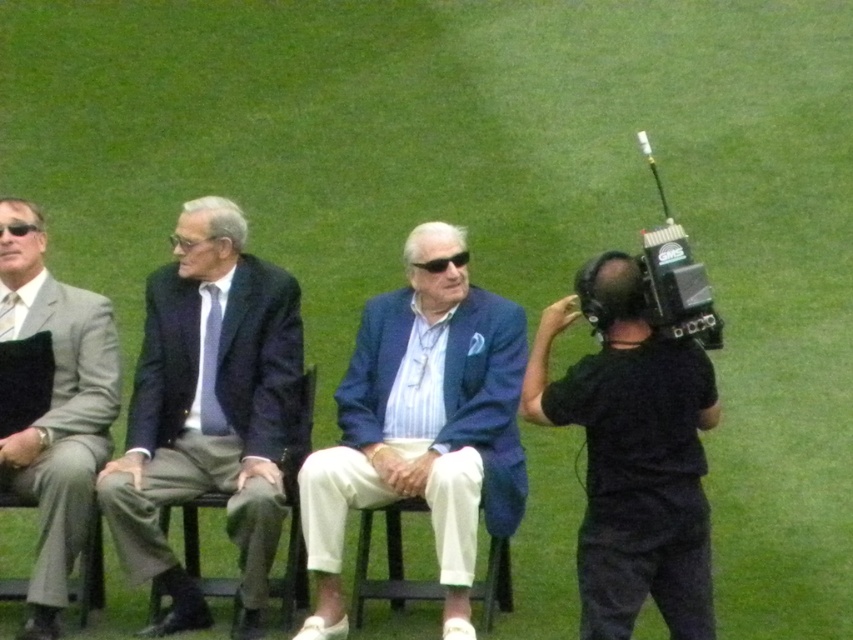
Question: Which point is closer to the camera?

Choices:
 (A) (39, 520)
 (B) (337, 502)
 (C) (692, 316)

Answer: (C)

Question: Considering the relative positions of black matte camera at right and dark gray fabric chair at center in the image provided, where is black matte camera at right located with respect to dark gray fabric chair at center?

Choices:
 (A) below
 (B) above

Answer: (B)

Question: Which object is farther from the camera taking this photo?

Choices:
 (A) black matte camera at right
 (B) matte black suit at center
 (C) matte gray suit at left
 (D) dark gray fabric chair at center

Answer: (D)

Question: Which point is closer to the camera taking this photo?

Choices:
 (A) (143, 497)
 (B) (711, 396)
 (C) (289, 595)
 (D) (664, 237)

Answer: (D)

Question: Is matte black suit at center wider than black plastic video camera at right?

Choices:
 (A) no
 (B) yes

Answer: (B)

Question: Does dark gray fabric chair at center have a greater width compared to black plastic video camera at right?

Choices:
 (A) yes
 (B) no

Answer: (B)